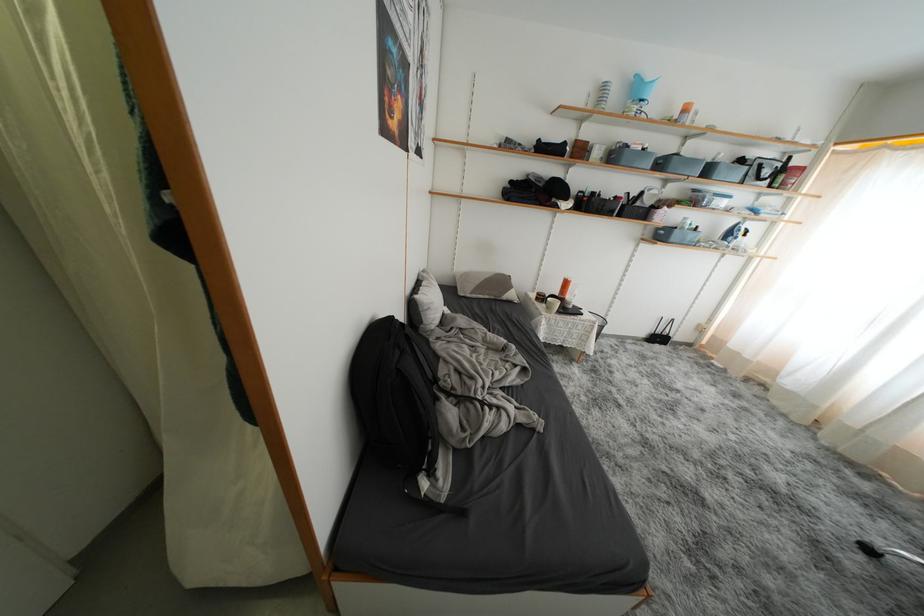
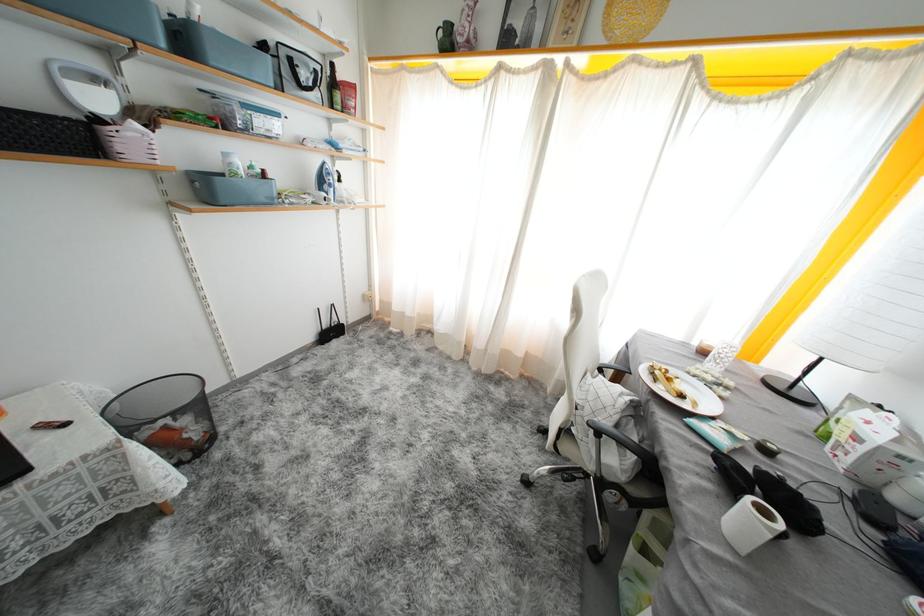
Find the pixel in the second image that matches [714,175] in the first image.

(190, 44)